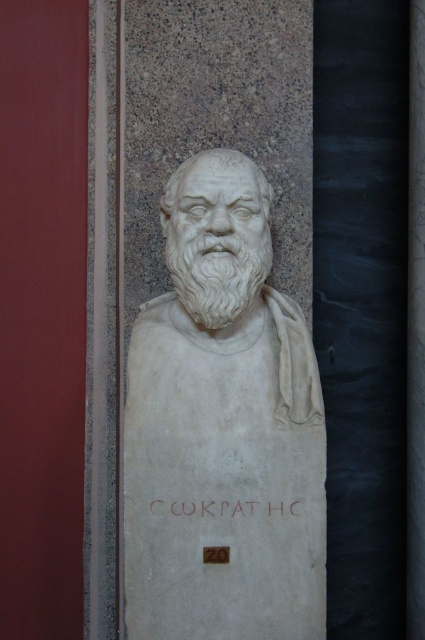
Question: Which object is closer to the camera taking this photo?

Choices:
 (A) white stone inscription at center
 (B) white marble bust at center

Answer: (B)

Question: Which point appears closest to the camera in this image?

Choices:
 (A) [x=201, y=513]
 (B) [x=248, y=275]

Answer: (A)

Question: Is white marble bust at center below white stone inscription at center?

Choices:
 (A) yes
 (B) no

Answer: (B)

Question: Is white marble bust at center to the left of white stone inscription at center from the viewer's perspective?

Choices:
 (A) yes
 (B) no

Answer: (A)

Question: Does white marble bust at center have a larger size compared to white stone inscription at center?

Choices:
 (A) no
 (B) yes

Answer: (B)

Question: Which point is farther from the camera taking this photo?

Choices:
 (A) (206, 502)
 (B) (189, 195)

Answer: (B)